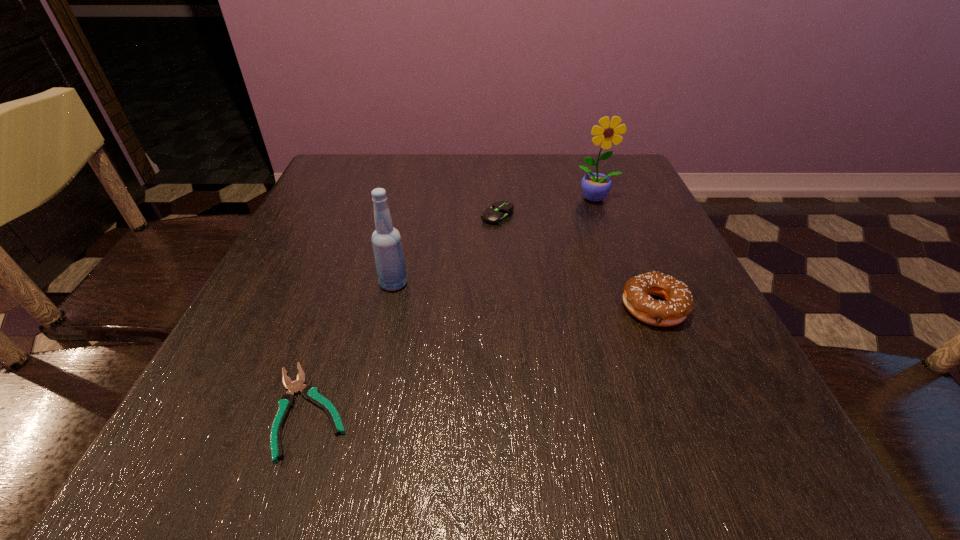
You are a GUI agent. You are given a task and a screenshot of the screen. Output one action in this format:
    pyautogui.click(x=<x>, y=<y>)
    Task: Click on the vacant point located between the doughnut and the sunflower
    
    Given the screenshot: What is the action you would take?
    pyautogui.click(x=625, y=253)

Locate an element on the screen. vacant area that lies between the nearest object and the bottle is located at coordinates (351, 347).

At what (x,y) coordinates should I click in order to perform the action: click on free space that is in between the sunflower and the pliers. Please return your answer as a coordinate pair (x, y). The image size is (960, 540). Looking at the image, I should click on click(453, 304).

Find the location of a particular element. This screenshot has height=540, width=960. free space between the nearest object and the computer mouse is located at coordinates (403, 313).

Find the location of a particular element. This screenshot has height=540, width=960. object that stands as the second closest to the shortest object is located at coordinates (500, 212).

Select which object is the third closest to the third object from left to right. Please provide its 2D coordinates. Your answer should be formatted as a tuple, i.e. [(x, y)], where the tuple contains the x and y coordinates of a point satisfying the conditions above.

[(678, 304)]

Locate an element on the screen. vacant space that satisfies the following two spatial constraints: 1. on the back side of the nearest object; 2. on the right side of the bottle is located at coordinates (351, 284).

The width and height of the screenshot is (960, 540). What are the coordinates of `vacant space that satisfies the following two spatial constraints: 1. on the back side of the third object from right to left; 2. on the left side of the bottle` in the screenshot? It's located at (409, 215).

The height and width of the screenshot is (540, 960). What are the coordinates of `vacant space that satisfies the following two spatial constraints: 1. on the front side of the computer mouse; 2. on the right side of the third shortest object` in the screenshot? It's located at (502, 308).

Where is `free spot that satisfies the following two spatial constraints: 1. on the back side of the nearest object; 2. on the right side of the third tallest object`? This screenshot has height=540, width=960. free spot that satisfies the following two spatial constraints: 1. on the back side of the nearest object; 2. on the right side of the third tallest object is located at coordinates (343, 308).